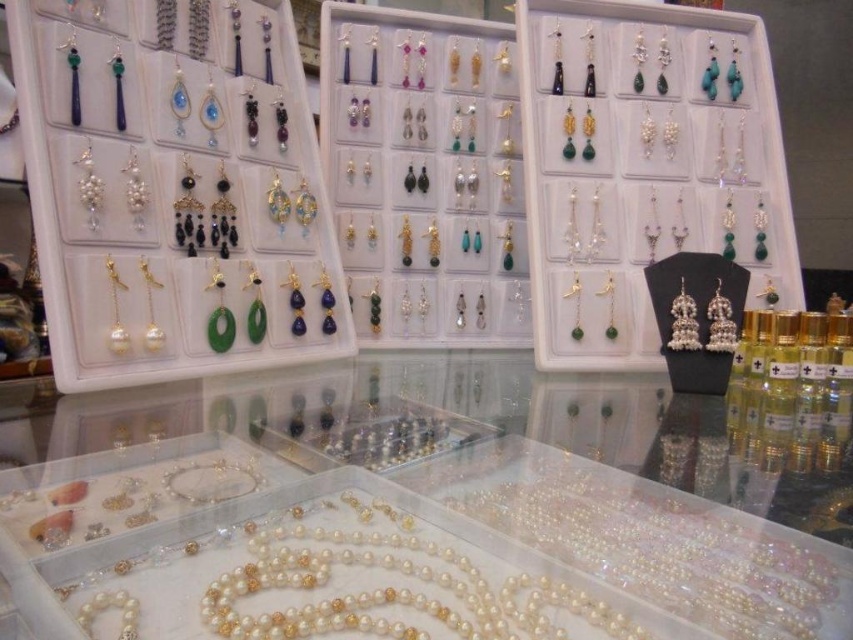
Question: Which of the following is the farthest from the observer?

Choices:
 (A) pearl/golden earrings at left
 (B) shiny silver earrings at center

Answer: (B)

Question: Does pearl/golden earrings at left have a smaller size compared to shiny silver earrings at center?

Choices:
 (A) no
 (B) yes

Answer: (A)

Question: Can you confirm if pearl/golden earrings at left is positioned to the left of shiny silver earrings at center?

Choices:
 (A) no
 (B) yes

Answer: (B)

Question: Can you confirm if pearl/golden earrings at left is positioned below shiny silver earrings at center?

Choices:
 (A) yes
 (B) no

Answer: (A)

Question: Which of the following is the farthest from the observer?

Choices:
 (A) pearl/golden earrings at left
 (B) shiny silver earrings at center

Answer: (B)